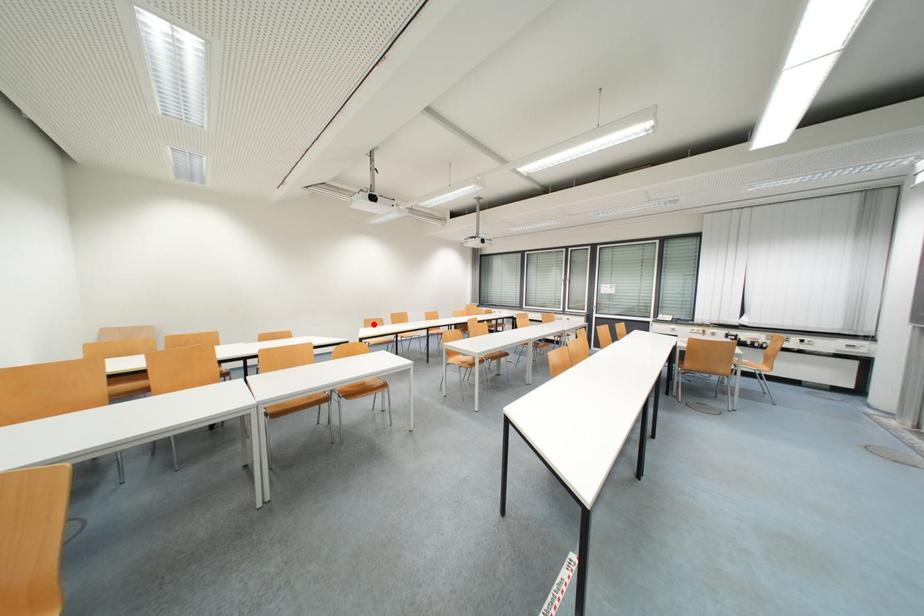
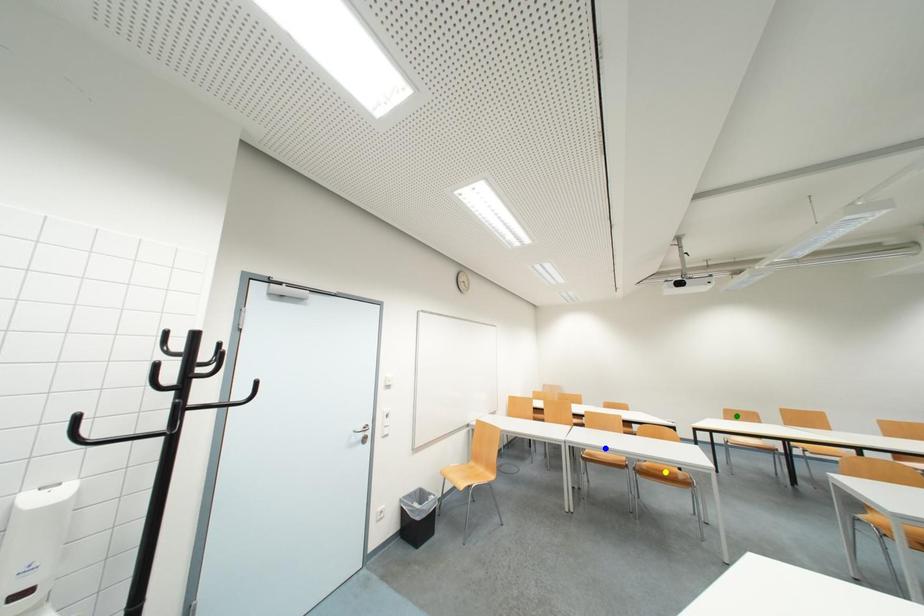
Question: I am providing you with two images of the same scene from different viewpoints. A red point is marked on the first image. You are given multiple points on the second image. In image 2, which mark is for the same physical point as the one in image 1?

Choices:
 (A) green point
 (B) blue point
 (C) yellow point

Answer: (A)